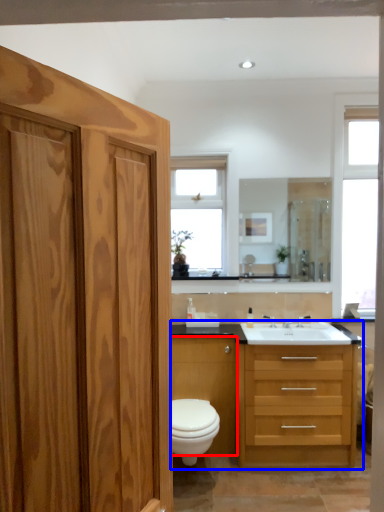
Question: Which point is closer to the camera, cabinetry (highlighted by a red box) or bathroom cabinet (highlighted by a blue box)?

Choices:
 (A) cabinetry
 (B) bathroom cabinet

Answer: (B)